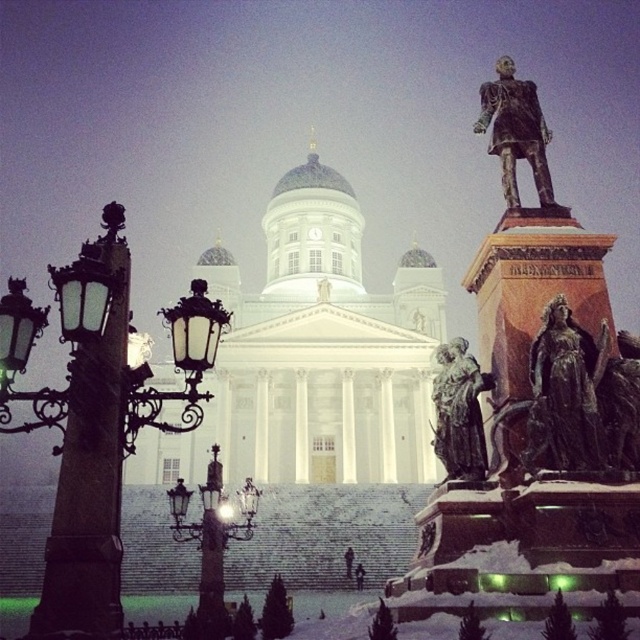
You are standing at the center of the image and want to locate the bronze statue at right. Based on the coordinates provided, in which direction should you look to find it?

The bronze statue at right is located at coordinates 0.623 on the x axis and 0.845 on the y axis, so you should look to the right side of the image to find it.

You are standing at the center of the winter scene and want to locate the matte black lamp post at left. According to the coordinates provided, in which direction should you look to find it?

Answer: The matte black lamp post at left is located at coordinates point [90,474], which means it is positioned to the left side of the scene. Therefore, you should look to your left to find it.